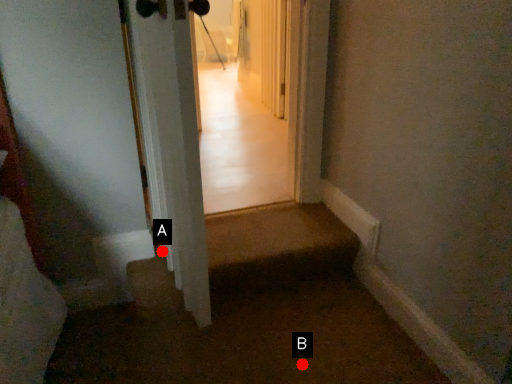
Question: Two points are circled on the image, labeled by A and B beside each circle. Which point is farther from the camera taking this photo?

Choices:
 (A) A is further
 (B) B is further

Answer: (A)